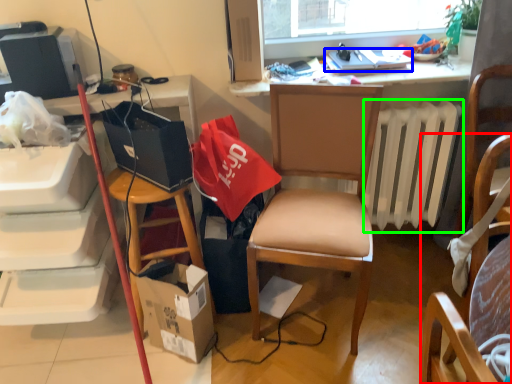
Question: Which object is positioned farthest from chair (highlighted by a red box)? Select from laptop (highlighted by a blue box) and radiator (highlighted by a green box).

Choices:
 (A) laptop
 (B) radiator

Answer: (A)